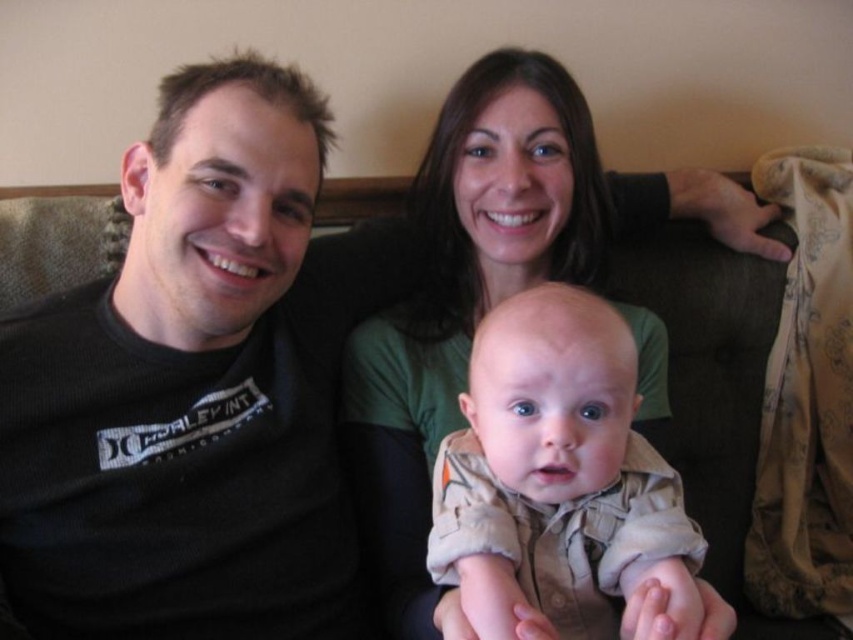
You are designing a gift box that must fit either the green matte shirt at center or the tan cotton onesie at center. Based on their sizes, which item would require a larger box?

The green matte shirt at center requires a larger box because its width is greater than that of the tan cotton onesie at center.